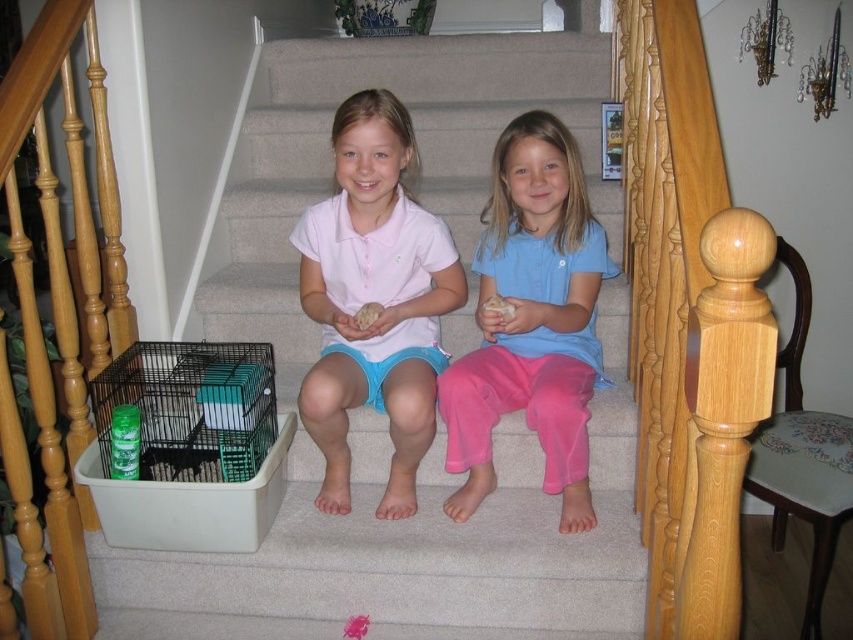
Question: Which object is the farthest from the matte pink shirt at center?

Choices:
 (A) white carpet at center
 (B) green plastic birdcage at lower left
 (C) fluffy beige hamster at center

Answer: (C)

Question: Is white carpet at center positioned behind blue cotton shirt at center?

Choices:
 (A) yes
 (B) no

Answer: (A)

Question: Can you confirm if matte pink shirt at center is bigger than green plastic birdcage at lower left?

Choices:
 (A) yes
 (B) no

Answer: (A)

Question: Which object is farther from the camera taking this photo?

Choices:
 (A) fluffy beige hamster at center
 (B) matte pink shirt at center
 (C) blue cotton shirt at center

Answer: (B)

Question: Which point appears farthest from the camera in this image?

Choices:
 (A) (381, 310)
 (B) (306, 426)
 (C) (502, 307)
 (D) (292, 112)

Answer: (D)

Question: Is blue cotton shirt at center bigger than white fluffy ball at center?

Choices:
 (A) no
 (B) yes

Answer: (B)